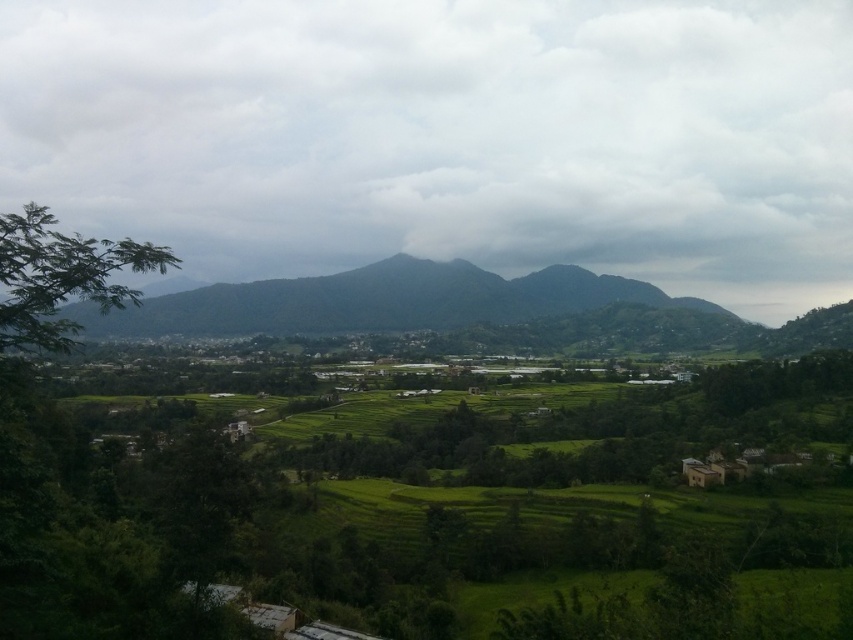
Question: Which of the following is the closest to the observer?

Choices:
 (A) (36, 285)
 (B) (177, 250)

Answer: (A)

Question: Does cloudy gray sky at upper center appear under green leafy tree at left?

Choices:
 (A) yes
 (B) no

Answer: (B)

Question: Can you confirm if cloudy gray sky at upper center is positioned to the right of green leafy tree at left?

Choices:
 (A) no
 (B) yes

Answer: (A)

Question: Is cloudy gray sky at upper center wider than green leafy tree at left?

Choices:
 (A) yes
 (B) no

Answer: (A)